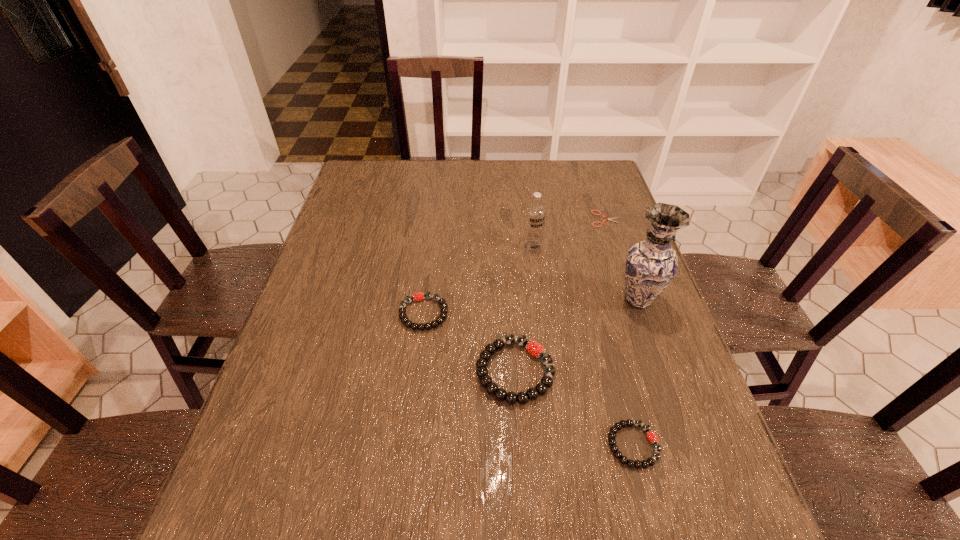
The width and height of the screenshot is (960, 540). In order to click on the farthest bracelet in this screenshot , I will do `click(419, 296)`.

This screenshot has width=960, height=540. I want to click on the leftmost bracelet, so click(419, 296).

What are the coordinates of `the second bracelet from left to right` in the screenshot? It's located at (534, 348).

Find the location of `the second nearest bracelet`. the second nearest bracelet is located at coordinates (534, 348).

Locate an element on the screen. the rightmost bracelet is located at coordinates (652, 437).

I want to click on the shortest bracelet, so click(652, 437).

This screenshot has width=960, height=540. Find the location of `vase`. vase is located at coordinates (651, 264).

Image resolution: width=960 pixels, height=540 pixels. I want to click on vodka, so click(x=535, y=213).

Where is `the second farthest object`? Image resolution: width=960 pixels, height=540 pixels. the second farthest object is located at coordinates (535, 213).

Where is `the shortest object`? the shortest object is located at coordinates (609, 219).